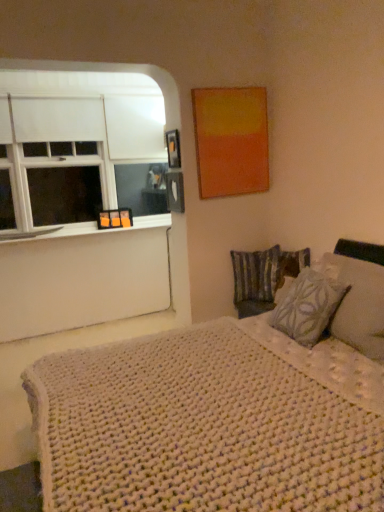
Describe the element at coordinates (85, 229) in the screenshot. I see `white painted wood at left` at that location.

Consider the image. In order to face patterned fabric pillow at right, marked as the first pillow in a front-to-back arrangement, should I rotate leftwards or rightwards?

You should rotate right by 14.733 degrees.

In order to click on metallic photo frame at upper center in this screenshot , I will do `click(173, 149)`.

How distant is patterned fabric pillow at right, the 2th pillow when ordered from back to front, from white matte window at left?

patterned fabric pillow at right, the 2th pillow when ordered from back to front, and white matte window at left are 2.53 meters apart from each other.

Does patterned fabric pillow at right, marked as the first pillow in a front-to-back arrangement, appear on the right side of white matte window at left?

Yes.

Who is bigger, patterned fabric pillow at right, the 2th pillow when ordered from back to front, or white matte window at left?

With larger size is white matte window at left.

Is white matte window at left completely or partially inside patterned fabric pillow at right, marked as the first pillow in a front-to-back arrangement?

That's incorrect, white matte window at left is not inside patterned fabric pillow at right, marked as the first pillow in a front-to-back arrangement.

How distant is metallic photo frame at upper center from white painted wood at left?

The distance of metallic photo frame at upper center from white painted wood at left is 1.16 meters.

Is metallic photo frame at upper center inside or outside of white painted wood at left?

metallic photo frame at upper center is not enclosed by white painted wood at left.

Consider the image. Considering the relative sizes of metallic photo frame at upper center and white painted wood at left in the image provided, is metallic photo frame at upper center thinner than white painted wood at left?

Correct, the width of metallic photo frame at upper center is less than that of white painted wood at left.

How far apart are white knitted blanket at lower right and metallic photo frame at upper center?

white knitted blanket at lower right and metallic photo frame at upper center are 6.95 feet apart from each other.

From the image's perspective, is white knitted blanket at lower right positioned above or below metallic photo frame at upper center?

From the image's perspective, white knitted blanket at lower right appears below metallic photo frame at upper center.

Does white knitted blanket at lower right have a larger size compared to metallic photo frame at upper center?

Indeed, white knitted blanket at lower right has a larger size compared to metallic photo frame at upper center.

Identify the location of picture frame above the striped fabric pillow at center-right, arranged as the first pillow when viewed from the back (from the image's perspective). (173, 149).

Looking at this image, considering the sizes of objects striped fabric pillow at center-right, arranged as the first pillow when viewed from the back, and metallic photo frame at upper center in the image provided, who is shorter, striped fabric pillow at center-right, arranged as the first pillow when viewed from the back, or metallic photo frame at upper center?

metallic photo frame at upper center.

Which object is wider, striped fabric pillow at center-right, the 2th pillow in the front-to-back sequence, or metallic photo frame at upper center?

With larger width is striped fabric pillow at center-right, the 2th pillow in the front-to-back sequence.

Image resolution: width=384 pixels, height=512 pixels. Find the location of `window positioned vertically above the patterned fabric pillow at right, marked as the first pillow in a front-to-back arrangement (from a real-world perspective)`. window positioned vertically above the patterned fabric pillow at right, marked as the first pillow in a front-to-back arrangement (from a real-world perspective) is located at coordinates (81, 130).

Looking at this image, would you say white matte window at left is a long distance from patterned fabric pillow at right, marked as the first pillow in a front-to-back arrangement?

Yes, white matte window at left is far from patterned fabric pillow at right, marked as the first pillow in a front-to-back arrangement.

Does point (14, 195) appear closer or farther from the camera than point (288, 327)?

Point (14, 195).

Is white painted wood at left completely or partially inside white knitted blanket at lower right?

Definitely not — white painted wood at left is not inside white knitted blanket at lower right.

The width and height of the screenshot is (384, 512). Find the location of `bed below the white painted wood at left (from a real-world perspective)`. bed below the white painted wood at left (from a real-world perspective) is located at coordinates (220, 415).

Which is behind, white knitted blanket at lower right or white painted wood at left?

white painted wood at left.

Between white knitted blanket at lower right and white painted wood at left, which one has larger size?

white knitted blanket at lower right is bigger.

From the picture: Is metallic photo frame at upper center aimed at white matte window at left?

No.

How different are the orientations of metallic photo frame at upper center and white matte window at left in degrees?

90.6 degrees.

Can you confirm if metallic photo frame at upper center is wider than white matte window at left?

Incorrect, the width of metallic photo frame at upper center does not surpass that of white matte window at left.

Is metallic photo frame at upper center in front of or behind white matte window at left in the image?

metallic photo frame at upper center is in front of white matte window at left.

From the white matte window at left, count 2nd pillows forward and point to it. Please provide its 2D coordinates.

[(308, 307)]

Where is `window sill that appears below the metallic photo frame at upper center (from a real-world perspective)`? The image size is (384, 512). window sill that appears below the metallic photo frame at upper center (from a real-world perspective) is located at coordinates (85, 229).

From the image, which object appears to be nearer to white knitted blanket at lower right, white painted wood at left or white matte window at left?

white matte window at left is closer to white knitted blanket at lower right.

Which object lies further to the anchor point white painted wood at left, white knitted blanket at lower right or patterned fabric pillow at right, the 2th pillow when ordered from back to front?

Among the two, white knitted blanket at lower right is located further to white painted wood at left.

From the picture: From the image, which object appears to be farther from white knitted blanket at lower right, metallic photo frame at upper center or striped fabric pillow at center-right, the 2th pillow in the front-to-back sequence?

metallic photo frame at upper center.

Estimate the real-world distances between objects in this image. Which object is further from metallic photo frame at upper center, white painted wood at left or patterned fabric pillow at right, the 2th pillow when ordered from back to front?

patterned fabric pillow at right, the 2th pillow when ordered from back to front, is positioned further to the anchor metallic photo frame at upper center.

Considering their positions, is striped fabric pillow at center-right, the 2th pillow in the front-to-back sequence, positioned further to white knitted blanket at lower right than metallic photo frame at upper center?

metallic photo frame at upper center.

Based on their spatial positions, is patterned fabric pillow at right, marked as the first pillow in a front-to-back arrangement, or white matte window at left further from white painted wood at left?

patterned fabric pillow at right, marked as the first pillow in a front-to-back arrangement.

Considering their positions, is patterned fabric pillow at right, marked as the first pillow in a front-to-back arrangement, positioned further to white matte window at left than white painted wood at left?

patterned fabric pillow at right, marked as the first pillow in a front-to-back arrangement, is further to white matte window at left.

Consider the image. Considering their positions, is white matte window at left positioned closer to striped fabric pillow at center-right, the 2th pillow in the front-to-back sequence, than white painted wood at left?

white painted wood at left lies closer to striped fabric pillow at center-right, the 2th pillow in the front-to-back sequence, than the other object.

In order to click on picture frame located between white knitted blanket at lower right and striped fabric pillow at center-right, arranged as the first pillow when viewed from the back, in the depth direction in this screenshot , I will do `click(173, 149)`.

You are a GUI agent. You are given a task and a screenshot of the screen. Output one action in this format:
    pyautogui.click(x=<x>, y=<y>)
    Task: Click on the picture frame positioned between white knitted blanket at lower right and white matte window at left from near to far
    Image resolution: width=384 pixels, height=512 pixels.
    Given the screenshot: What is the action you would take?
    pyautogui.click(x=173, y=149)

Image resolution: width=384 pixels, height=512 pixels. I want to click on window between white knitted blanket at lower right and white painted wood at left along the z-axis, so click(x=81, y=130).

Identify the location of window sill between white matte window at left and striped fabric pillow at center-right, arranged as the first pillow when viewed from the back. (85, 229).